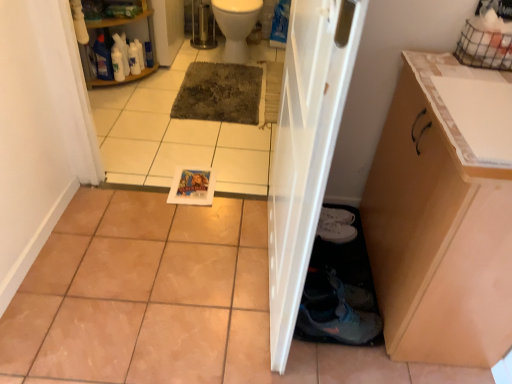
Locate an element on the screen. vacant space underneath white glossy door at center (from a real-world perspective) is located at coordinates (260, 291).